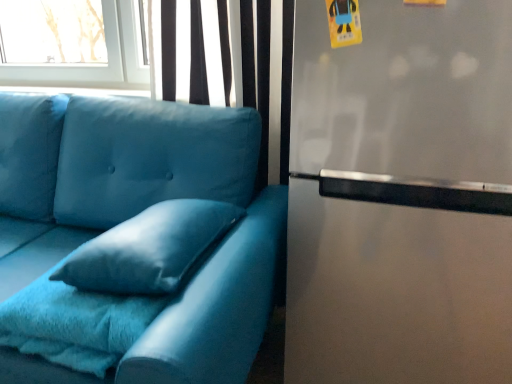
Identify the location of fuzzy blue blanket at lower left. The image size is (512, 384). (75, 323).

At what (x,y) coordinates should I click in order to perform the action: click on velvet blue pillow at center. Please return your answer as a coordinate pair (x, y). This screenshot has width=512, height=384. Looking at the image, I should click on (149, 248).

At what (x,y) coordinates should I click in order to perform the action: click on fuzzy blue blanket at lower left. Please return your answer as a coordinate pair (x, y). Looking at the image, I should click on pyautogui.click(x=75, y=323).

Between fuzzy blue blanket at lower left and matte blue fabric couch at left, which one appears on the left side from the viewer's perspective?

From the viewer's perspective, matte blue fabric couch at left appears more on the left side.

Who is smaller, fuzzy blue blanket at lower left or matte blue fabric couch at left?

Smaller between the two is fuzzy blue blanket at lower left.

Is fuzzy blue blanket at lower left facing away from matte blue fabric couch at left?

Yes, fuzzy blue blanket at lower left is positioned with its back facing matte blue fabric couch at left.

Is there a large distance between fuzzy blue blanket at lower left and matte blue fabric couch at left?

No, fuzzy blue blanket at lower left is not far away from matte blue fabric couch at left.

Locate an element on the screen. Image resolution: width=512 pixels, height=384 pixels. fridge located on the right of matte blue fabric couch at left is located at coordinates (401, 195).

Considering the relative positions of stainless steel fridge at right and matte blue fabric couch at left in the image provided, is stainless steel fridge at right in front of matte blue fabric couch at left?

No, stainless steel fridge at right is behind matte blue fabric couch at left.

Looking at their sizes, would you say stainless steel fridge at right is wider or thinner than matte blue fabric couch at left?

Considering their sizes, stainless steel fridge at right looks slimmer than matte blue fabric couch at left.

Is stainless steel fridge at right touching fuzzy blue blanket at lower left?

stainless steel fridge at right is not next to fuzzy blue blanket at lower left, and they're not touching.

From the image's perspective, which one is positioned higher, stainless steel fridge at right or fuzzy blue blanket at lower left?

stainless steel fridge at right appears higher in the image.

From a real-world perspective, is stainless steel fridge at right physically above fuzzy blue blanket at lower left?

Correct, in the physical world, stainless steel fridge at right is higher than fuzzy blue blanket at lower left.

From the image's perspective, who appears lower, matte blue fabric couch at left or stainless steel fridge at right?

matte blue fabric couch at left.

Is matte blue fabric couch at left not inside stainless steel fridge at right?

Yes, matte blue fabric couch at left is located beyond the bounds of stainless steel fridge at right.

What's the angular difference between matte blue fabric couch at left and stainless steel fridge at right's facing directions?

The facing directions of matte blue fabric couch at left and stainless steel fridge at right are 1.86 degrees apart.

Considering the sizes of objects velvet blue pillow at center and stainless steel fridge at right in the image provided, who is shorter, velvet blue pillow at center or stainless steel fridge at right?

With less height is velvet blue pillow at center.

Is point (166, 259) in front of point (381, 188)?

Yes, point (166, 259) is in front of point (381, 188).

Consider the image. Is velvet blue pillow at center to the left or to the right of stainless steel fridge at right in the image?

In the image, velvet blue pillow at center appears on the left side of stainless steel fridge at right.

There is a fuzzy blue blanket at lower left. Where is `pillow above it (from a real-world perspective)`? Image resolution: width=512 pixels, height=384 pixels. pillow above it (from a real-world perspective) is located at coordinates 149,248.

How far apart are velvet blue pillow at center and fuzzy blue blanket at lower left?

velvet blue pillow at center and fuzzy blue blanket at lower left are 4.83 inches apart from each other.

From the image's perspective, relative to fuzzy blue blanket at lower left, is velvet blue pillow at center above or below?

Clearly, from the image's perspective, velvet blue pillow at center is above fuzzy blue blanket at lower left.

From a real-world perspective, which is physically above, velvet blue pillow at center or fuzzy blue blanket at lower left?

velvet blue pillow at center is physically above.

Does stainless steel fridge at right contain velvet blue pillow at center?

No.

Are stainless steel fridge at right and velvet blue pillow at center located far from each other?

No, stainless steel fridge at right is in close proximity to velvet blue pillow at center.

Is stainless steel fridge at right closer to camera compared to velvet blue pillow at center?

That is True.

Image resolution: width=512 pixels, height=384 pixels. I want to click on studio couch located on the left of fuzzy blue blanket at lower left, so click(x=147, y=235).

Find the location of a particular element. fridge that appears above the matte blue fabric couch at left (from the image's perspective) is located at coordinates (x=401, y=195).

From the image, which object appears to be farther from velvet blue pillow at center, stainless steel fridge at right or matte blue fabric couch at left?

stainless steel fridge at right lies further to velvet blue pillow at center than the other object.

When comparing their distances from fuzzy blue blanket at lower left, does matte blue fabric couch at left or velvet blue pillow at center seem closer?

The object closer to fuzzy blue blanket at lower left is velvet blue pillow at center.

From the image, which object appears to be nearer to velvet blue pillow at center, matte blue fabric couch at left or fuzzy blue blanket at lower left?

fuzzy blue blanket at lower left is positioned closer to the anchor velvet blue pillow at center.

When comparing their distances from stainless steel fridge at right, does matte blue fabric couch at left or velvet blue pillow at center seem further?

The object further to stainless steel fridge at right is matte blue fabric couch at left.

Estimate the real-world distances between objects in this image. Which object is closer to fuzzy blue blanket at lower left, stainless steel fridge at right or velvet blue pillow at center?

velvet blue pillow at center.

Considering their positions, is fuzzy blue blanket at lower left positioned further to velvet blue pillow at center than stainless steel fridge at right?

stainless steel fridge at right lies further to velvet blue pillow at center than the other object.

Looking at the image, which one is located closer to matte blue fabric couch at left, fuzzy blue blanket at lower left or velvet blue pillow at center?

velvet blue pillow at center.

Based on their spatial positions, is stainless steel fridge at right or fuzzy blue blanket at lower left further from matte blue fabric couch at left?

Among the two, stainless steel fridge at right is located further to matte blue fabric couch at left.

Locate an element on the screen. This screenshot has height=384, width=512. blanket situated between matte blue fabric couch at left and velvet blue pillow at center from left to right is located at coordinates (75, 323).

Identify the location of pillow between fuzzy blue blanket at lower left and stainless steel fridge at right from left to right. This screenshot has height=384, width=512. (149, 248).

Locate an element on the screen. The width and height of the screenshot is (512, 384). blanket situated between matte blue fabric couch at left and stainless steel fridge at right from left to right is located at coordinates (75, 323).

You are a GUI agent. You are given a task and a screenshot of the screen. Output one action in this format:
    pyautogui.click(x=<x>, y=<y>)
    Task: Click on the pillow between matte blue fabric couch at left and stainless steel fridge at right from left to right
    Image resolution: width=512 pixels, height=384 pixels.
    Given the screenshot: What is the action you would take?
    pyautogui.click(x=149, y=248)